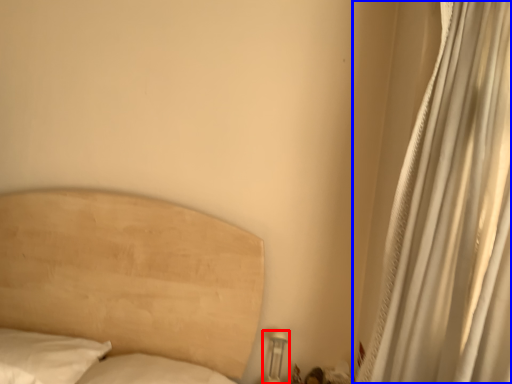
Question: Among these objects, which one is nearest to the camera, table lamp (highlighted by a red box) or curtain (highlighted by a blue box)?

Choices:
 (A) table lamp
 (B) curtain

Answer: (B)